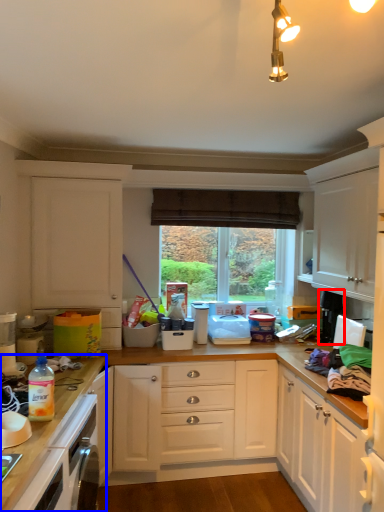
Question: Which of the following is the closest to the observer, appliance (highlighted by a red box) or countertop (highlighted by a blue box)?

Choices:
 (A) appliance
 (B) countertop

Answer: (B)